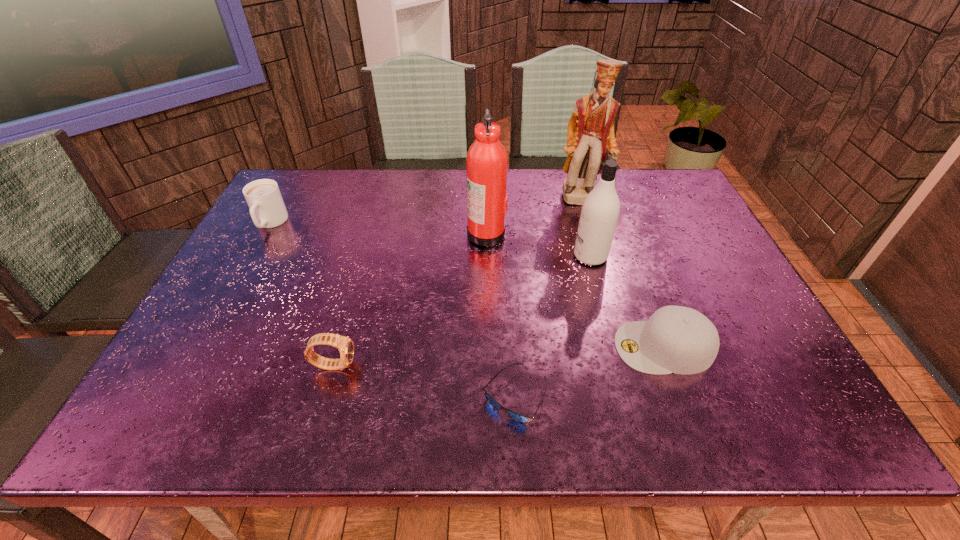
Find the location of a particular element. The width and height of the screenshot is (960, 540). free location located 0.300m on the label side of the fire extinguisher is located at coordinates (362, 233).

Find the location of a particular element. The width and height of the screenshot is (960, 540). vacant area located on the label side of the fire extinguisher is located at coordinates (428, 233).

This screenshot has width=960, height=540. Identify the location of vacant space located on the front-facing side of the third tallest object. point(447,256).

I want to click on vacant point located on the front-facing side of the third tallest object, so click(x=473, y=256).

Where is `free spot located on the front-facing side of the third tallest object`? Image resolution: width=960 pixels, height=540 pixels. free spot located on the front-facing side of the third tallest object is located at coordinates (488, 256).

This screenshot has height=540, width=960. Identify the location of vacant space located 0.130m on the side with the handle of the cappuccino. (244, 269).

Where is `vacant space located on the face of the sixth object from right to left`? vacant space located on the face of the sixth object from right to left is located at coordinates (539, 364).

Where is `vacant position located 0.060m on the front-facing side of the cap`? The height and width of the screenshot is (540, 960). vacant position located 0.060m on the front-facing side of the cap is located at coordinates (588, 347).

Locate an element on the screen. The width and height of the screenshot is (960, 540). free space located on the front-facing side of the cap is located at coordinates 520,347.

Locate an element on the screen. The image size is (960, 540). vacant space situated on the front-facing side of the cap is located at coordinates (520, 347).